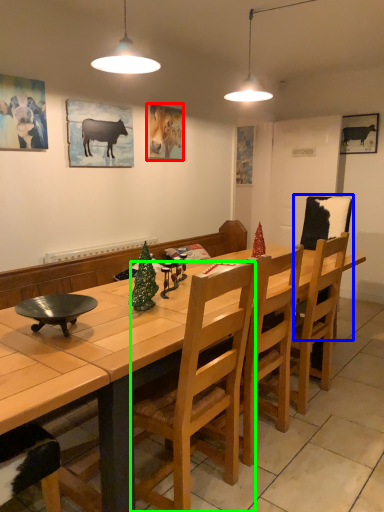
Question: Which is farther away from picture frame (highlighted by a red box)? armchair (highlighted by a blue box) or chair (highlighted by a green box)?

Choices:
 (A) armchair
 (B) chair

Answer: (B)